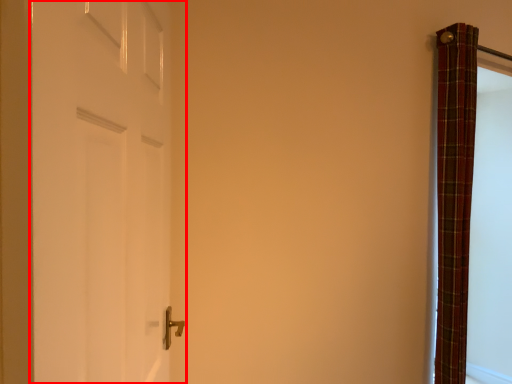
Question: From the image's perspective, considering the relative positions of door (annotated by the red box) and curtain in the image provided, where is door (annotated by the red box) located with respect to the staircase?

Choices:
 (A) above
 (B) below

Answer: (A)